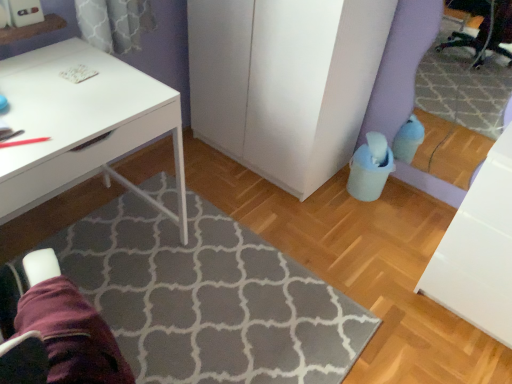
What do you see at coordinates (53, 329) in the screenshot? I see `purple fabric swivel chair at lower left` at bounding box center [53, 329].

Describe the element at coordinates (209, 299) in the screenshot. The height and width of the screenshot is (384, 512). I see `gray textured rug at center` at that location.

What do you see at coordinates (285, 82) in the screenshot? I see `white matte cabinet at center` at bounding box center [285, 82].

Where is `purple fabric swivel chair at lower left`? purple fabric swivel chair at lower left is located at coordinates (53, 329).

From a real-world perspective, is gray textured rug at center on purple fabric swivel chair at lower left?

Actually, gray textured rug at center is physically below purple fabric swivel chair at lower left in the real world.

From the image's perspective, which one is positioned higher, gray textured rug at center or purple fabric swivel chair at lower left?

gray textured rug at center, from the image's perspective.

Is gray textured rug at center directly adjacent to purple fabric swivel chair at lower left?

No, gray textured rug at center is not making contact with purple fabric swivel chair at lower left.

Is white matte desk at upper left positioned with its back to purple fabric swivel chair at lower left?

white matte desk at upper left is not turned away from purple fabric swivel chair at lower left.

From a real-world perspective, which object rests below the other?

From a 3D spatial view, purple fabric swivel chair at lower left is below.

Identify the location of desk behind the purple fabric swivel chair at lower left. This screenshot has width=512, height=384. (82, 123).

Is white matte desk at upper left not close to purple fabric swivel chair at lower left?

Actually, white matte desk at upper left and purple fabric swivel chair at lower left are a little close together.

From a real-world perspective, between purple fabric swivel chair at lower left and gray textured rug at center, who is vertically higher?

In real-world perspective, purple fabric swivel chair at lower left is above.

Would you say purple fabric swivel chair at lower left is a long distance from gray textured rug at center?

No, purple fabric swivel chair at lower left is in close proximity to gray textured rug at center.

Does point (66, 328) come in front of point (231, 340)?

Yes, it is in front of point (231, 340).

Which of these two, purple fabric swivel chair at lower left or gray textured rug at center, is smaller?

Smaller between the two is purple fabric swivel chair at lower left.

Is white matte cabinet at center located outside gray textured rug at center?

Absolutely, white matte cabinet at center is external to gray textured rug at center.

Is white matte cabinet at center far away from gray textured rug at center?

They are positioned close to each other.

Can you confirm if white matte cabinet at center is positioned to the right of gray textured rug at center?

Correct, you'll find white matte cabinet at center to the right of gray textured rug at center.

Where is `doormat that is under the white matte desk at upper left (from a real-world perspective)`? This screenshot has height=384, width=512. doormat that is under the white matte desk at upper left (from a real-world perspective) is located at coordinates (209, 299).

Is gray textured rug at center smaller than white matte desk at upper left?

Yes, gray textured rug at center is smaller than white matte desk at upper left.

Is gray textured rug at center facing away from white matte desk at upper left?

No, white matte desk at upper left is not at the back of gray textured rug at center.

In the scene shown: Between gray textured rug at center and white matte desk at upper left, which one appears on the left side from the viewer's perspective?

white matte desk at upper left.

Find the location of a particular element. The width and height of the screenshot is (512, 384). desk behind the purple fabric swivel chair at lower left is located at coordinates (82, 123).

From their relative heights in the image, would you say purple fabric swivel chair at lower left is taller or shorter than white matte desk at upper left?

Clearly, purple fabric swivel chair at lower left is shorter compared to white matte desk at upper left.

Is purple fabric swivel chair at lower left spatially inside white matte desk at upper left, or outside of it?

purple fabric swivel chair at lower left exists outside the volume of white matte desk at upper left.

What's the angular difference between white glossy file cabinet at lower right and purple fabric swivel chair at lower left's facing directions?

104 degrees separate the facing orientations of white glossy file cabinet at lower right and purple fabric swivel chair at lower left.

Which is in front, white glossy file cabinet at lower right or purple fabric swivel chair at lower left?

Positioned in front is purple fabric swivel chair at lower left.

In terms of height, does white glossy file cabinet at lower right look taller or shorter compared to purple fabric swivel chair at lower left?

In the image, white glossy file cabinet at lower right appears to be taller than purple fabric swivel chair at lower left.

Identify the location of swivel chair in front of the gray textured rug at center. The image size is (512, 384). (53, 329).

This screenshot has width=512, height=384. I want to click on swivel chair to the right of white matte desk at upper left, so click(53, 329).

From the image, which object appears to be farther from purple fabric swivel chair at lower left, white matte desk at upper left or gray textured rug at center?

The object further to purple fabric swivel chair at lower left is gray textured rug at center.

From the image, which object appears to be farther from gray textured rug at center, purple fabric swivel chair at lower left or white matte cabinet at center?

purple fabric swivel chair at lower left.

Estimate the real-world distances between objects in this image. Which object is further from white matte desk at upper left, white matte cabinet at center or white glossy file cabinet at lower right?

The object further to white matte desk at upper left is white glossy file cabinet at lower right.

When comparing their distances from white glossy file cabinet at lower right, does white matte desk at upper left or white matte cabinet at center seem further?

white matte desk at upper left lies further to white glossy file cabinet at lower right than the other object.

Based on their spatial positions, is white glossy file cabinet at lower right or purple fabric swivel chair at lower left further from white matte desk at upper left?

The object further to white matte desk at upper left is white glossy file cabinet at lower right.

Estimate the real-world distances between objects in this image. Which object is closer to white glossy file cabinet at lower right, gray textured rug at center or white matte desk at upper left?

gray textured rug at center is closer to white glossy file cabinet at lower right.

Looking at the image, which one is located closer to white matte desk at upper left, purple fabric swivel chair at lower left or gray textured rug at center?

Among the two, purple fabric swivel chair at lower left is located nearer to white matte desk at upper left.

Considering their positions, is white glossy file cabinet at lower right positioned further to white matte desk at upper left than gray textured rug at center?

white glossy file cabinet at lower right.

Image resolution: width=512 pixels, height=384 pixels. Find the location of `dresser situated between gray textured rug at center and white glossy file cabinet at lower right from left to right`. dresser situated between gray textured rug at center and white glossy file cabinet at lower right from left to right is located at coordinates (285, 82).

At what (x,y) coordinates should I click in order to perform the action: click on desk between white matte cabinet at center and purple fabric swivel chair at lower left from top to bottom. Please return your answer as a coordinate pair (x, y). Looking at the image, I should click on (82, 123).

Identify the location of doormat situated between white matte desk at upper left and white glossy file cabinet at lower right from left to right. This screenshot has width=512, height=384. (209, 299).

Locate an element on the screen. Image resolution: width=512 pixels, height=384 pixels. doormat between white matte cabinet at center and purple fabric swivel chair at lower left in the up-down direction is located at coordinates coord(209,299).